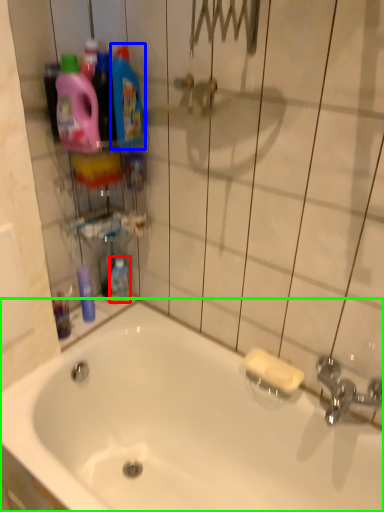
Question: Which object is the closest to the mouthwash (highlighted by a red box)? Choose among these: cleaning product (highlighted by a blue box) or bathtub (highlighted by a green box).

Choices:
 (A) cleaning product
 (B) bathtub

Answer: (B)